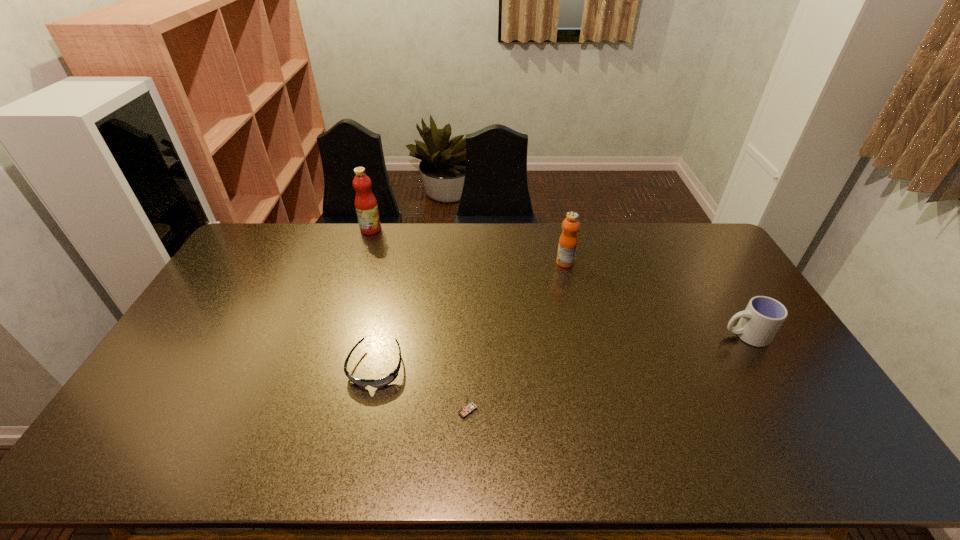
You are a GUI agent. You are given a task and a screenshot of the screen. Output one action in this format:
    pyautogui.click(x=<x>, y=<y>)
    Task: Click on the free region at the left edge of the desktop
    
    Given the screenshot: What is the action you would take?
    pyautogui.click(x=229, y=296)

This screenshot has width=960, height=540. Identify the location of vacant space at the right edge of the desktop. (734, 295).

The width and height of the screenshot is (960, 540). I want to click on free point between the cup and the second tallest object, so click(x=655, y=299).

You are a GUI agent. You are given a task and a screenshot of the screen. Output one action in this format:
    pyautogui.click(x=<x>, y=<y>)
    Task: Click on the vacant space that's between the matchbox and the shortest object
    
    Given the screenshot: What is the action you would take?
    pyautogui.click(x=421, y=389)

Find the location of a particular element. This screenshot has width=960, height=540. blank region between the fourth tallest object and the cup is located at coordinates (607, 373).

You are a GUI agent. You are given a task and a screenshot of the screen. Output one action in this format:
    pyautogui.click(x=<x>, y=<y>)
    Task: Click on the vacant area that lies between the third object from left to right and the sunglasses
    The height and width of the screenshot is (540, 960).
    Given the screenshot: What is the action you would take?
    pyautogui.click(x=421, y=389)

You are a GUI agent. You are given a task and a screenshot of the screen. Output one action in this format:
    pyautogui.click(x=<x>, y=<y>)
    Task: Click on the vacant area that lies between the rightmost object and the fourth object from right to left
    
    Given the screenshot: What is the action you would take?
    pyautogui.click(x=561, y=351)

Where is `vacant space that's between the cup and the fourth object from right to left`? This screenshot has width=960, height=540. vacant space that's between the cup and the fourth object from right to left is located at coordinates (561, 351).

You are a GUI agent. You are given a task and a screenshot of the screen. Output one action in this format:
    pyautogui.click(x=<x>, y=<y>)
    Task: Click on the vacant area that lies between the fourth tallest object and the third shortest object
    The image size is (960, 540).
    Given the screenshot: What is the action you would take?
    pyautogui.click(x=607, y=373)

This screenshot has height=540, width=960. In order to click on vacant space that's between the third object from left to right and the rightmost object in this screenshot , I will do `click(607, 373)`.